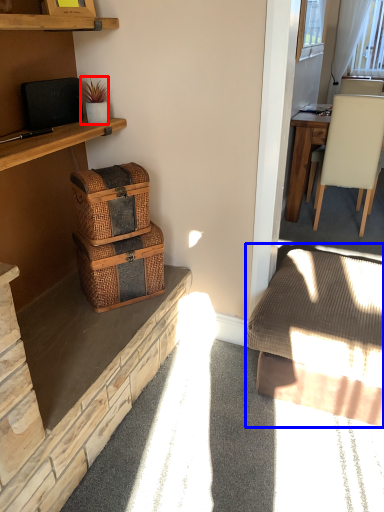
Question: Which point is closer to the camera, houseplant (highlighted by a red box) or studio couch (highlighted by a blue box)?

Choices:
 (A) houseplant
 (B) studio couch

Answer: (B)